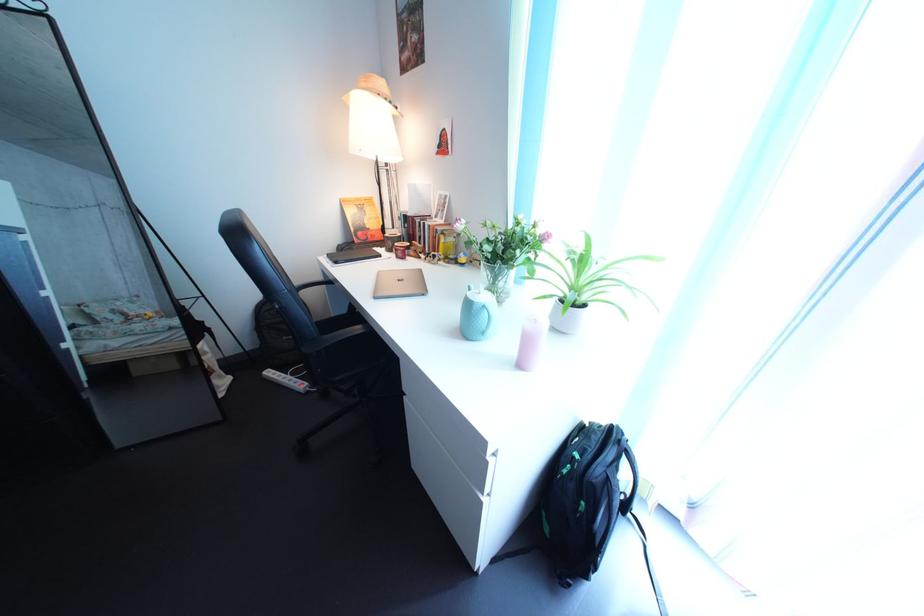
The image size is (924, 616). Find the location of `blue pitcher handle`. blue pitcher handle is located at coordinates (487, 322).